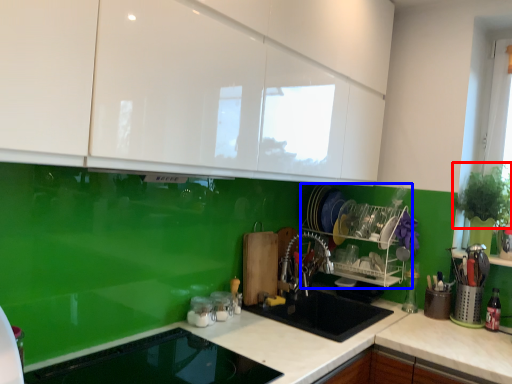
Question: Which object appears closest to the camera in this image, plant (highlighted by a red box) or appliance (highlighted by a blue box)?

Choices:
 (A) plant
 (B) appliance

Answer: (A)